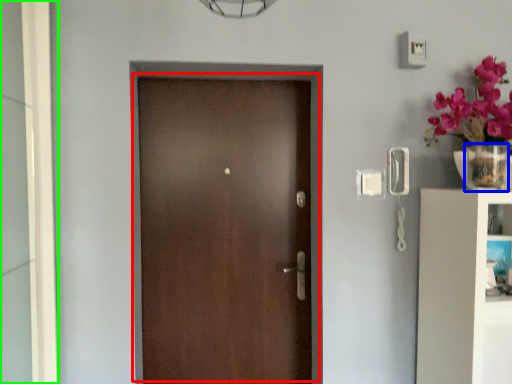
Question: Considering the real-world distances, which object is closest to door (highlighted by a red box)? glass vase (highlighted by a blue box) or glass door (highlighted by a green box).

Choices:
 (A) glass vase
 (B) glass door

Answer: (B)